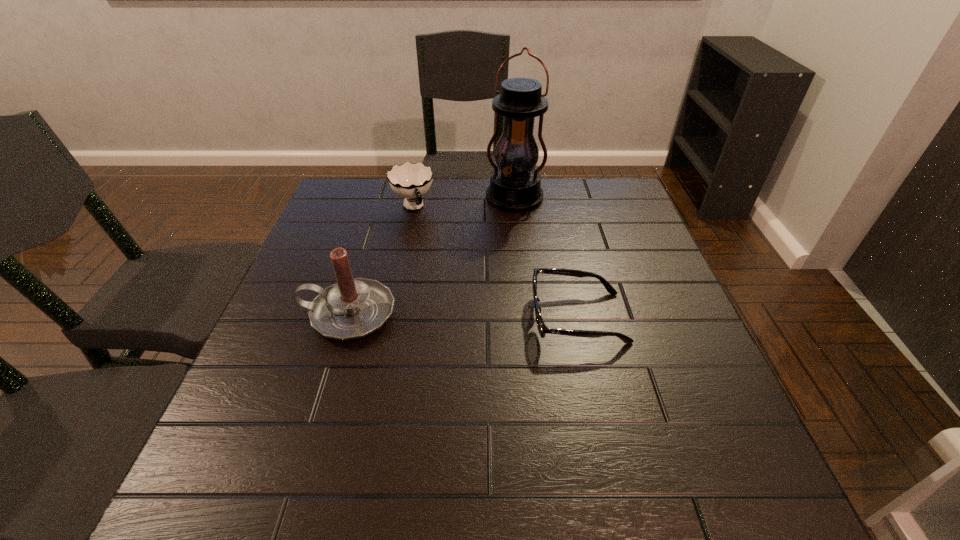
I want to click on free spot on the desktop that is between the candle and the spectacles and is positioned on the side of the second shortest object with the handle, so click(472, 316).

Where is `vacant space on the desktop that is between the second tallest object and the spectacles and is positioned above the tallest object, indicating its light source`? Image resolution: width=960 pixels, height=540 pixels. vacant space on the desktop that is between the second tallest object and the spectacles and is positioned above the tallest object, indicating its light source is located at coordinates (484, 316).